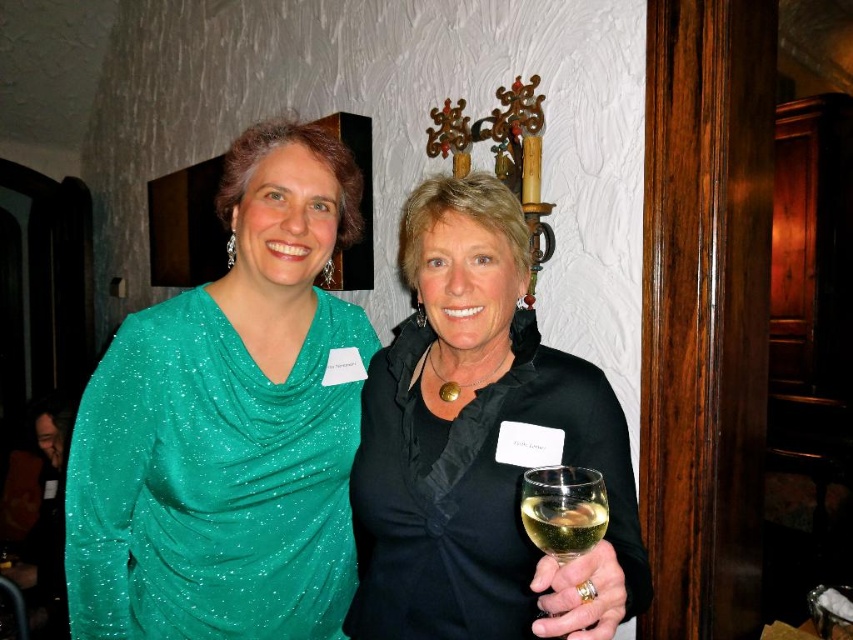
In the scene shown: Who is shorter, black satin blouse at center or clear glass wine glass at center?

Standing shorter between the two is clear glass wine glass at center.

What do you see at coordinates (479, 445) in the screenshot? I see `black satin blouse at center` at bounding box center [479, 445].

At what (x,y) coordinates should I click in order to perform the action: click on black satin blouse at center. Please return your answer as a coordinate pair (x, y). The image size is (853, 640). Looking at the image, I should click on (479, 445).

Does green sparkly dress at center have a lesser height compared to clear glass wine glass at center?

In fact, green sparkly dress at center may be taller than clear glass wine glass at center.

How much distance is there between green sparkly dress at center and clear glass wine glass at center?

24.15 inches

Is point (195, 417) closer to camera compared to point (560, 472)?

No, (195, 417) is further to viewer.

This screenshot has height=640, width=853. What are the coordinates of `green sparkly dress at center` in the screenshot? It's located at (229, 424).

Locate an element on the screen. green sparkly dress at center is located at coordinates (229, 424).

This screenshot has height=640, width=853. What do you see at coordinates (229, 424) in the screenshot?
I see `green sparkly dress at center` at bounding box center [229, 424].

Consider the image. Who is more distant from viewer, (x=96, y=609) or (x=404, y=593)?

The point (x=404, y=593) is behind.

I want to click on green sparkly dress at center, so click(x=229, y=424).